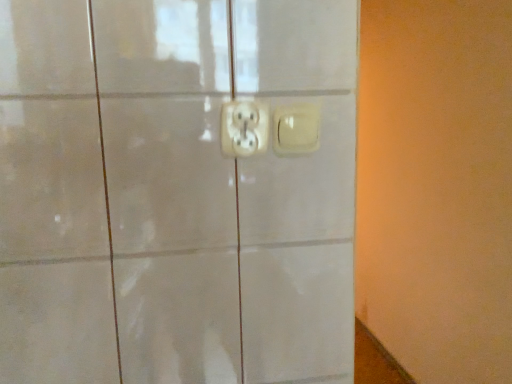
Question: Is point (241, 132) positioned closer to the camera than point (290, 137)?

Choices:
 (A) farther
 (B) closer

Answer: (B)

Question: From the image's perspective, is white plastic power plug and socket at center positioned above or below matte white switch at center?

Choices:
 (A) above
 (B) below

Answer: (A)

Question: Considering the positions of white plastic power plug and socket at center and matte white switch at center in the image, is white plastic power plug and socket at center taller or shorter than matte white switch at center?

Choices:
 (A) tall
 (B) short

Answer: (A)

Question: From a real-world perspective, relative to white plastic power plug and socket at center, is matte white switch at center vertically above or below?

Choices:
 (A) below
 (B) above

Answer: (A)

Question: Do you think matte white switch at center is within white plastic power plug and socket at center, or outside of it?

Choices:
 (A) inside
 (B) outside

Answer: (B)

Question: From the image's perspective, relative to white plastic power plug and socket at center, is matte white switch at center above or below?

Choices:
 (A) below
 (B) above

Answer: (A)

Question: Does point (294, 115) appear closer or farther from the camera than point (248, 104)?

Choices:
 (A) farther
 (B) closer

Answer: (A)